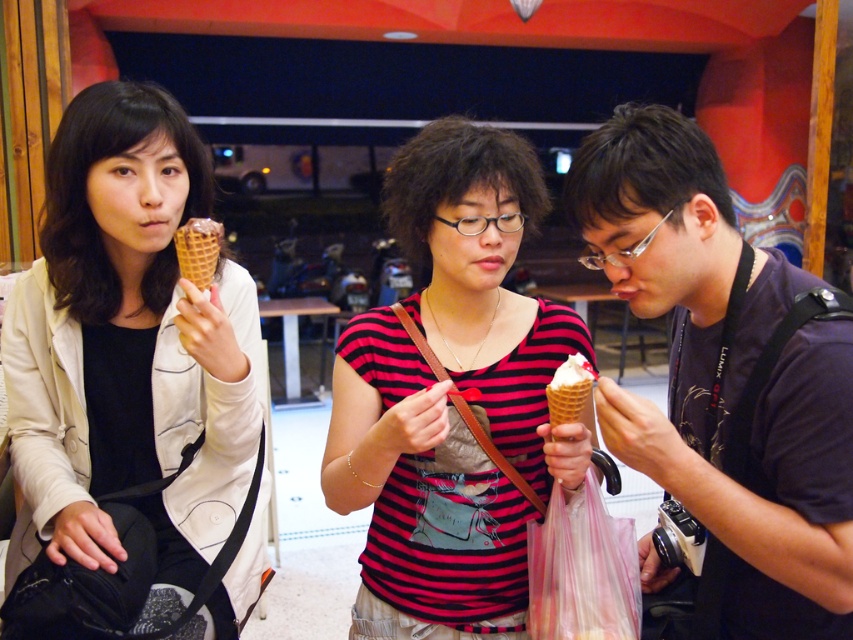
Question: Can you confirm if matte brown ice cream cone at left is wider than chocolate waffle cone at left?

Choices:
 (A) no
 (B) yes

Answer: (B)

Question: Which of the following is the closest to the observer?

Choices:
 (A) (132, 272)
 (B) (549, 387)

Answer: (B)

Question: Is matte black shirt at center above striped fabric shirt at center?

Choices:
 (A) yes
 (B) no

Answer: (A)

Question: Does matte black shirt at center have a smaller size compared to white creamy ice cream at center?

Choices:
 (A) yes
 (B) no

Answer: (B)

Question: Among these objects, which one is farthest from the camera?

Choices:
 (A) striped fabric shirt at center
 (B) white creamy ice cream at center

Answer: (A)

Question: Among these objects, which one is farthest from the camera?

Choices:
 (A) white creamy ice cream at center
 (B) striped fabric shirt at center
 (C) matte brown ice cream cone at left

Answer: (C)